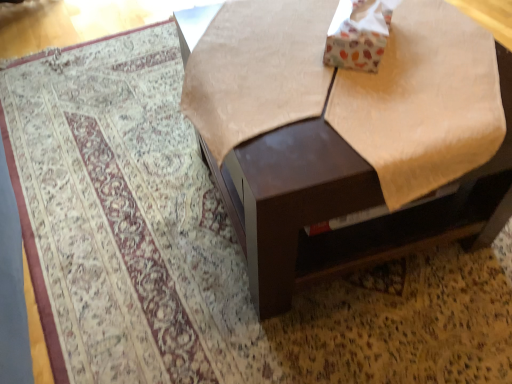
Question: From the image's perspective, relative to white cardboard box at upper right, is brown glossy table at upper center above or below?

Choices:
 (A) above
 (B) below

Answer: (B)

Question: Considering the relative positions of brown glossy table at upper center and white cardboard box at upper right in the image provided, is brown glossy table at upper center to the left or to the right of white cardboard box at upper right?

Choices:
 (A) left
 (B) right

Answer: (A)

Question: In terms of height, does brown glossy table at upper center look taller or shorter compared to white cardboard box at upper right?

Choices:
 (A) tall
 (B) short

Answer: (A)

Question: From their relative heights in the image, would you say white cardboard box at upper right is taller or shorter than brown glossy table at upper center?

Choices:
 (A) short
 (B) tall

Answer: (A)

Question: Relative to brown glossy table at upper center, is white cardboard box at upper right in front or behind?

Choices:
 (A) behind
 (B) front

Answer: (A)

Question: Visually, is white cardboard box at upper right positioned to the left or to the right of brown glossy table at upper center?

Choices:
 (A) left
 (B) right

Answer: (B)

Question: Is white cardboard box at upper right wider or thinner than brown glossy table at upper center?

Choices:
 (A) wide
 (B) thin

Answer: (B)